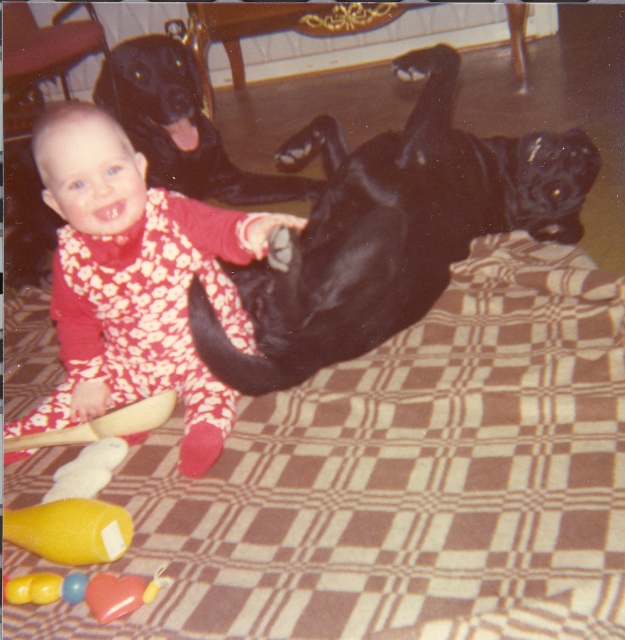
From the picture: You are a photographer trying to capture a closeup of the baby and the dog in the scene. You are currently positioned at point (x=56, y=592). If you move forward towards the scene, will point (x=55, y=298) become closer to you or farther away?

Point (x=55, y=298) is behind point (x=56, y=592). Moving forward towards the scene from point (x=56, y=592) would make point (x=55, y=298) become closer to you.

You are a photographer setting up for a family photo. You need to position the floral fabric toddler at center and the shiny black dog at upper center so that they can see each other clearly. Given their current distance apart, is the 3.43 feet separation sufficient for them to see each other comfortably?

The floral fabric toddler at center and the shiny black dog at upper center are 3.43 feet apart from each other, which is a sufficient distance for them to see each other comfortably without being too close.